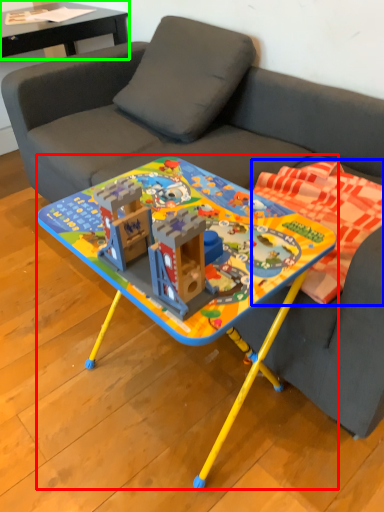
Question: Which object is the farthest from table (highlighted by a red box)? Choose among these: blanket (highlighted by a blue box) or table (highlighted by a green box).

Choices:
 (A) blanket
 (B) table

Answer: (B)